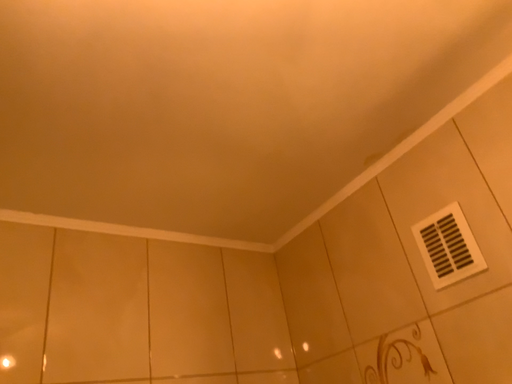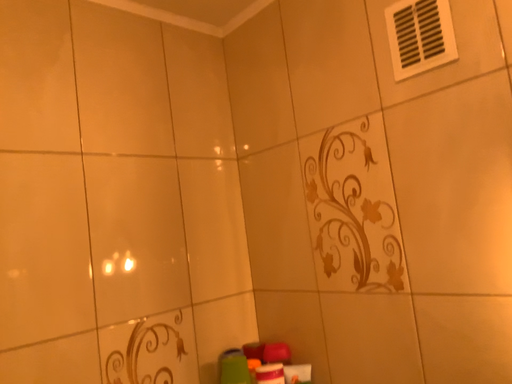
Question: How did the camera likely rotate when shooting the video?

Choices:
 (A) rotated left
 (B) rotated right

Answer: (B)